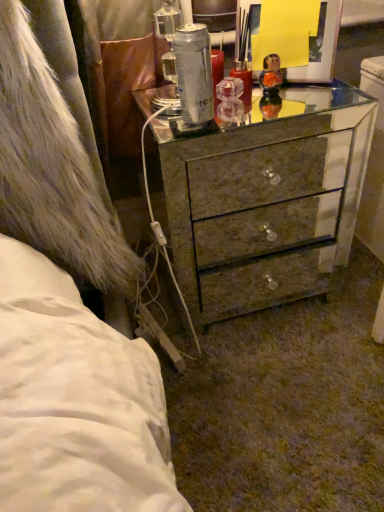
Question: Is metallic mirrored chest of drawers at center thinner than translucent glass figurine at upper center?

Choices:
 (A) yes
 (B) no

Answer: (B)

Question: Is the depth of metallic mirrored chest of drawers at center greater than that of translucent glass figurine at upper center?

Choices:
 (A) yes
 (B) no

Answer: (B)

Question: Can you confirm if metallic mirrored chest of drawers at center is smaller than translucent glass figurine at upper center?

Choices:
 (A) yes
 (B) no

Answer: (B)

Question: From the image's perspective, does metallic mirrored chest of drawers at center appear lower than translucent glass figurine at upper center?

Choices:
 (A) yes
 (B) no

Answer: (A)

Question: Considering the relative sizes of metallic mirrored chest of drawers at center and translucent glass figurine at upper center in the image provided, is metallic mirrored chest of drawers at center wider than translucent glass figurine at upper center?

Choices:
 (A) no
 (B) yes

Answer: (B)

Question: Can you confirm if metallic mirrored chest of drawers at center is taller than translucent glass figurine at upper center?

Choices:
 (A) no
 (B) yes

Answer: (B)

Question: From the image's perspective, is translucent glass figurine at upper center located above metallic mirrored chest of drawers at center?

Choices:
 (A) yes
 (B) no

Answer: (A)

Question: Could you tell me if translucent glass figurine at upper center is facing metallic mirrored chest of drawers at center?

Choices:
 (A) yes
 (B) no

Answer: (B)

Question: From a real-world perspective, does translucent glass figurine at upper center stand above metallic mirrored chest of drawers at center?

Choices:
 (A) no
 (B) yes

Answer: (B)

Question: From a real-world perspective, does translucent glass figurine at upper center sit lower than metallic mirrored chest of drawers at center?

Choices:
 (A) no
 (B) yes

Answer: (A)

Question: Is translucent glass figurine at upper center at the left side of metallic mirrored chest of drawers at center?

Choices:
 (A) no
 (B) yes

Answer: (A)

Question: Considering the relative sizes of translucent glass figurine at upper center and metallic mirrored chest of drawers at center in the image provided, is translucent glass figurine at upper center smaller than metallic mirrored chest of drawers at center?

Choices:
 (A) yes
 (B) no

Answer: (A)

Question: Considering the positions of metallic mirrored chest of drawers at center and translucent glass figurine at upper center in the image, is metallic mirrored chest of drawers at center wider or thinner than translucent glass figurine at upper center?

Choices:
 (A) wide
 (B) thin

Answer: (A)